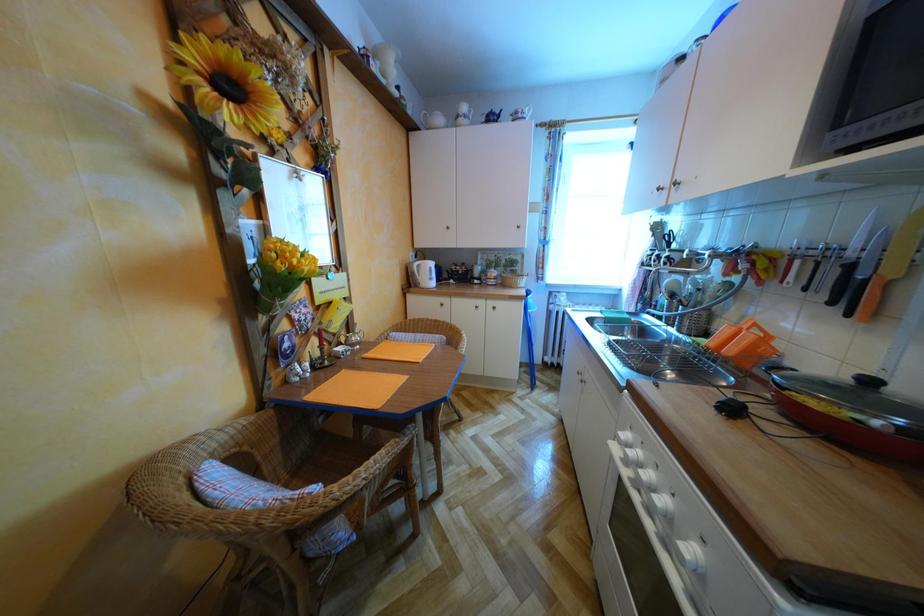
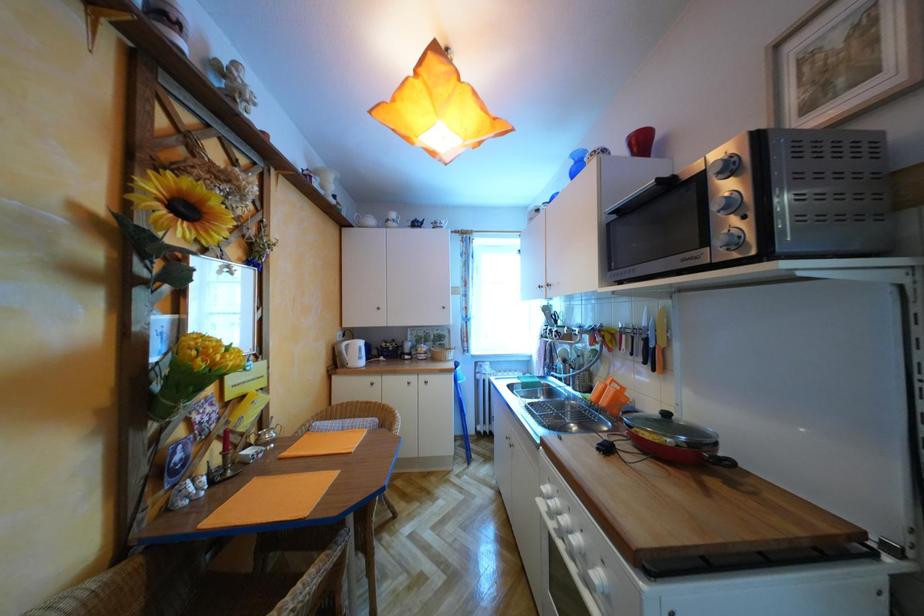
Question: Which direction would the cameraman need to move to produce the second image? Reply with the corresponding letter.

Choices:
 (A) Left
 (B) Right
 (C) Forward
 (D) Backward

Answer: (D)